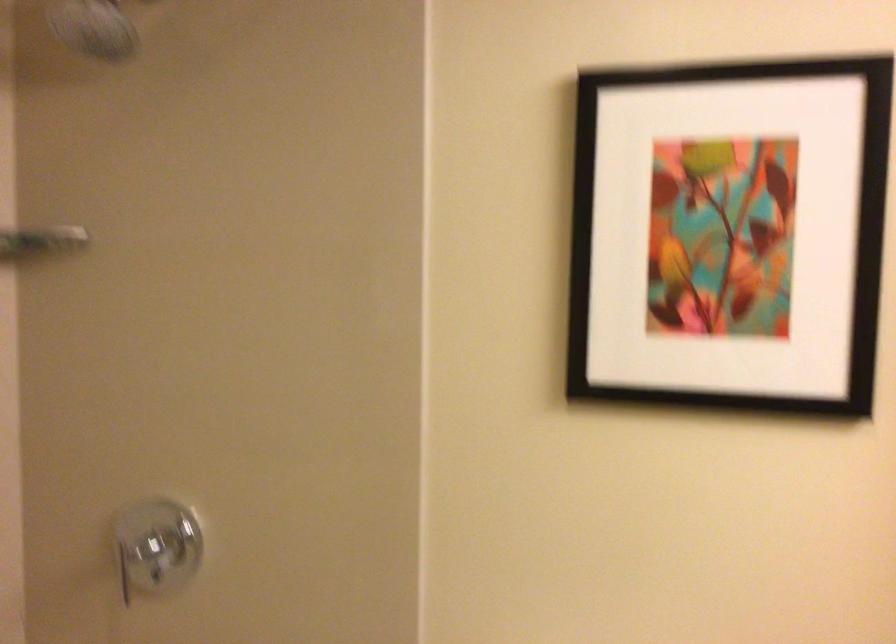
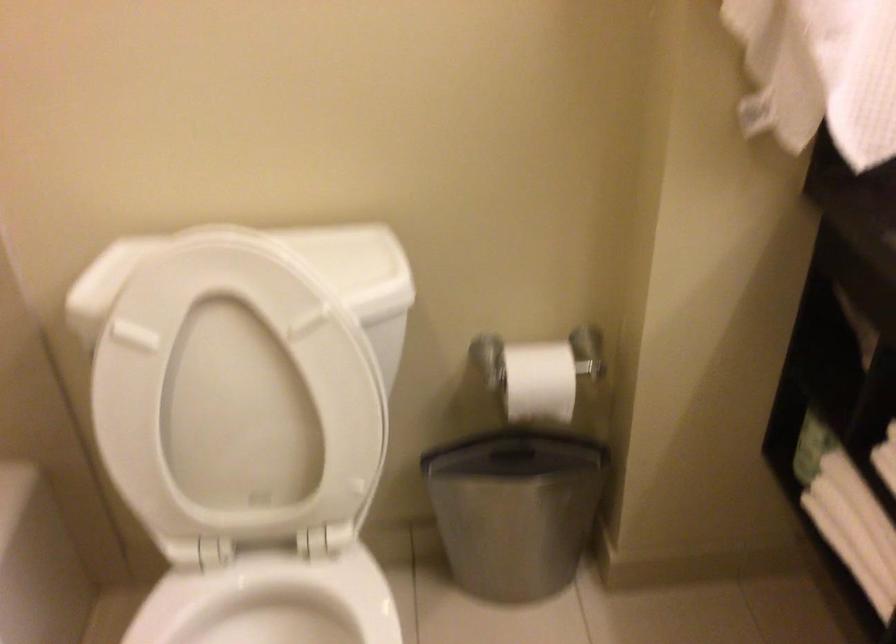
Based on the continuous images, in which direction is the camera rotating?

The camera rotated toward right-down.